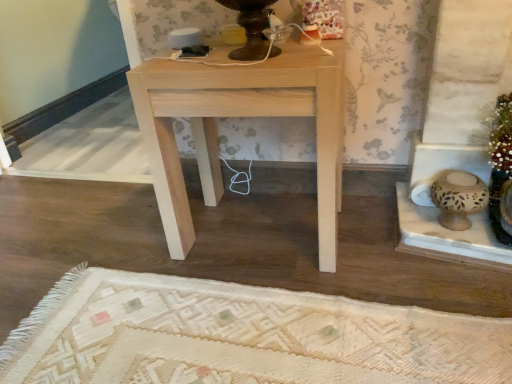
The width and height of the screenshot is (512, 384). I want to click on light wood/texture nightstand at center, so click(x=240, y=116).

The image size is (512, 384). What do you see at coordinates (240, 116) in the screenshot?
I see `light wood/texture nightstand at center` at bounding box center [240, 116].

Where is `light wood/texture nightstand at center`? light wood/texture nightstand at center is located at coordinates (240, 116).